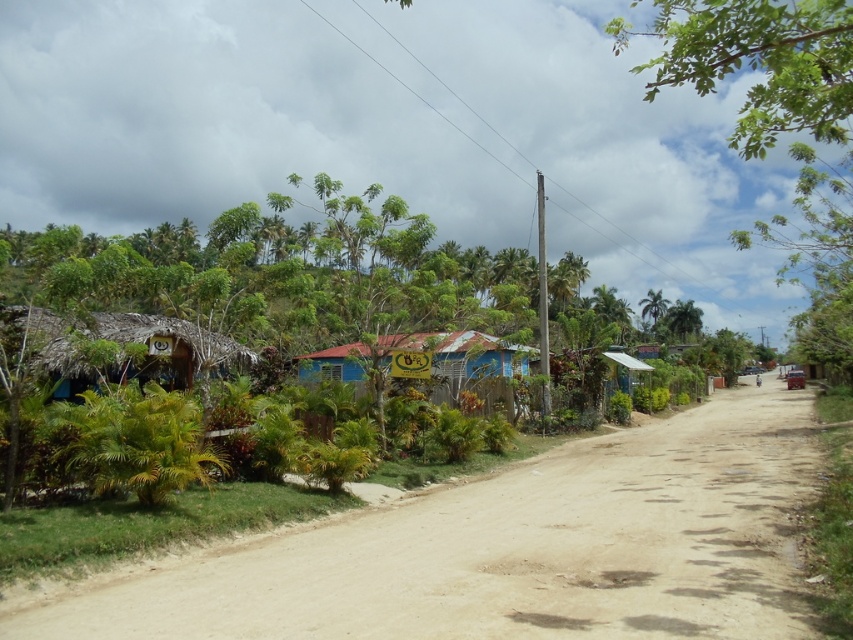
You are a traveler on the dirt road and need to reach the blue corrugated metal hut at center. Which direction should you head to from the thatched roof hut at left?

The thatched roof hut at left is to the left of blue corrugated metal hut at center, so you should head to the right to reach the blue corrugated metal hut at center from the thatched roof hut at left.

You are standing on the blue corrugated metal hut at center and want to walk to the brown sandy dirt track at center. Which direction should you face to walk towards the dirt track?

You should face to the right to walk towards the brown sandy dirt track at center since it is located to the right of the blue corrugated metal hut at center.

You are a traveler standing on the brown sandy dirt track at center and want to reach the thatched roof hut at left. Which direction should you walk to get there?

The brown sandy dirt track at center is not as tall as the thatched roof hut at left, so you should walk to the left along the dirt track to reach the thatched roof hut at left.